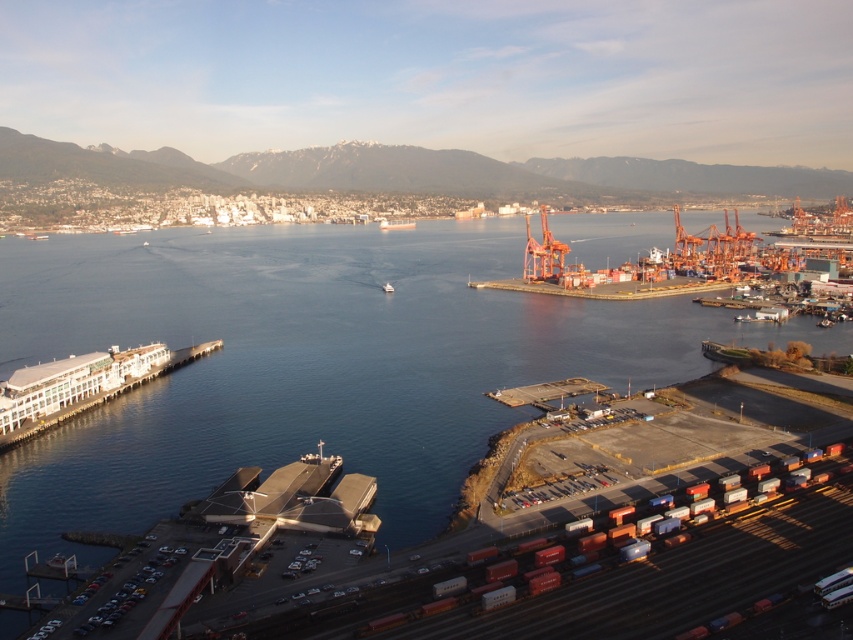
Who is higher up, blue water at center or white plastic boat at center?

blue water at center is above.

This screenshot has height=640, width=853. What do you see at coordinates (306, 362) in the screenshot? I see `blue water at center` at bounding box center [306, 362].

The width and height of the screenshot is (853, 640). Find the location of `blue water at center`. blue water at center is located at coordinates (306, 362).